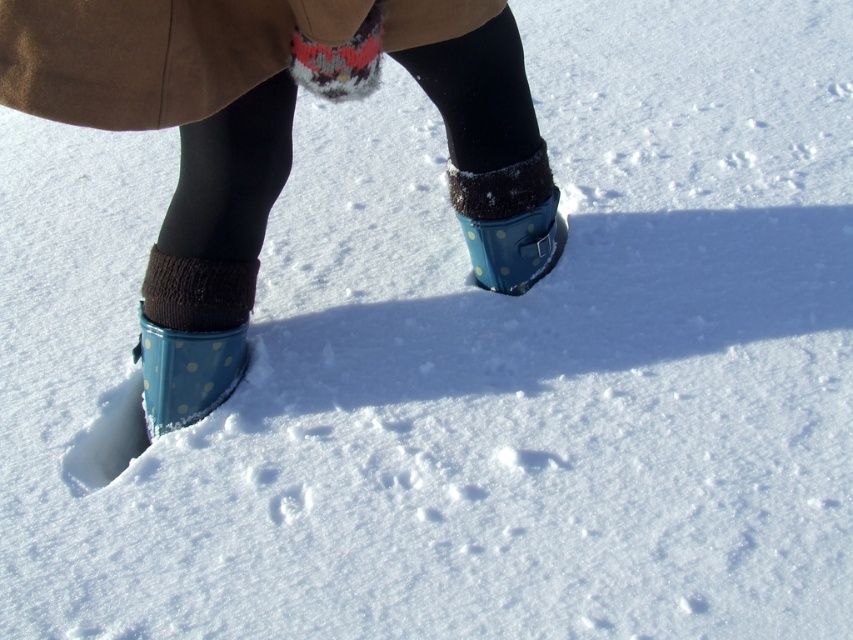
Where is `brown woolen trench coat at upper center`? brown woolen trench coat at upper center is located at coordinates (152, 54).

From the picture: How much distance is there between brown woolen trench coat at upper center and blue polka dot rubber boot at center?

They are 47.29 centimeters apart.

In order to click on brown woolen trench coat at upper center in this screenshot , I will do coord(152,54).

Measure the distance between blue polka dot rubber boots at center and camera.

The distance of blue polka dot rubber boots at center from camera is 3.89 feet.

Describe the element at coordinates (276, 141) in the screenshot. The height and width of the screenshot is (640, 853). I see `blue polka dot rubber boots at center` at that location.

Is point (247, 326) closer to viewer compared to point (178, 388)?

No, (247, 326) is further to viewer.

Identify the location of blue polka dot rubber boots at center. point(276,141).

Between brown woolen trench coat at upper center and blue polka dot rubber boot at lower left, which one is positioned lower?

Positioned lower is blue polka dot rubber boot at lower left.

I want to click on brown woolen trench coat at upper center, so click(x=152, y=54).

Does point (91, 88) lie behind point (149, 412)?

No.

Where is `brown woolen trench coat at upper center`? Image resolution: width=853 pixels, height=640 pixels. brown woolen trench coat at upper center is located at coordinates (152, 54).